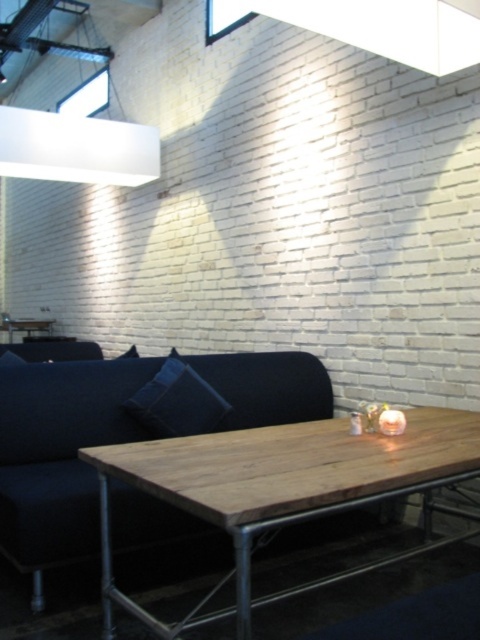
Who is positioned more to the right, dark blue fabric couch at center or dark blue fabric pillow at center?

dark blue fabric couch at center is more to the right.

Between point (199, 387) and point (190, 429), which one is positioned behind?

The point (199, 387) is more distant.

Locate an element on the screen. The height and width of the screenshot is (640, 480). dark blue fabric couch at center is located at coordinates (120, 433).

Consider the image. Who is more forward, (7,148) or (225,410)?

Point (225,410) is more forward.

Is point (127, 182) positioned after point (164, 410)?

Yes, point (127, 182) is behind point (164, 410).

Who is more distant from viewer, (58, 145) or (179, 369)?

Point (58, 145)

Locate an element on the screen. white matte rectangular light fixture at upper left is located at coordinates (76, 148).

Looking at this image, which is more to the right, dark blue fabric couch at center or rustic wood table at center?

rustic wood table at center

Who is lower down, dark blue fabric couch at center or rustic wood table at center?

rustic wood table at center

This screenshot has height=640, width=480. I want to click on dark blue fabric couch at center, so click(x=120, y=433).